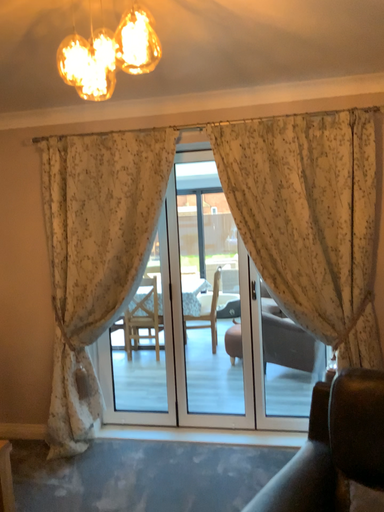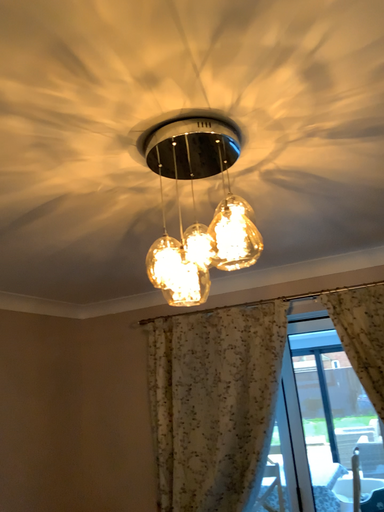
Question: How did the camera likely rotate when shooting the video?

Choices:
 (A) rotated upward
 (B) rotated downward

Answer: (A)